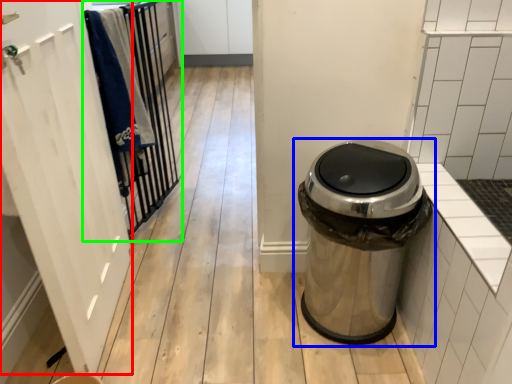
Question: Which object is the closest to the screen door (highlighted by a red box)? Choose among these: waste container (highlighted by a blue box) or closet (highlighted by a green box).

Choices:
 (A) waste container
 (B) closet

Answer: (B)